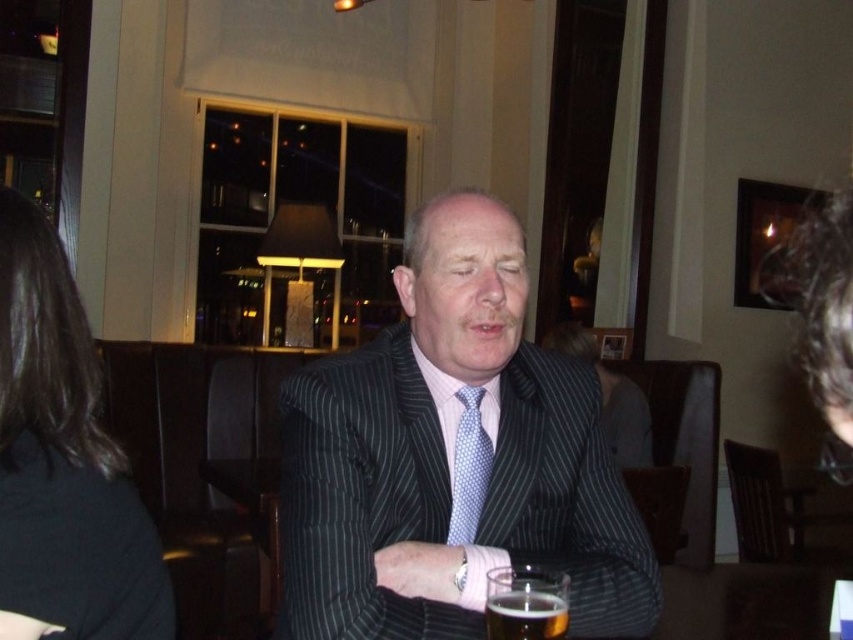
Is pinstriped suit at center below clear glass at lower center?

No.

Is pinstriped suit at center bigger than clear glass at lower center?

Correct, pinstriped suit at center is larger in size than clear glass at lower center.

Which is in front, point (322, 472) or point (514, 611)?

Point (514, 611) is in front.

The width and height of the screenshot is (853, 640). Find the location of `pinstriped suit at center`. pinstriped suit at center is located at coordinates (451, 458).

Describe the element at coordinates (451, 458) in the screenshot. I see `pinstriped suit at center` at that location.

Does pinstriped suit at center appear on the left side of blue dotted tie at center?

Yes, pinstriped suit at center is to the left of blue dotted tie at center.

Between point (502, 333) and point (465, 429), which one is positioned behind?

Point (465, 429)

Where is `pinstriped suit at center`? pinstriped suit at center is located at coordinates (451, 458).

This screenshot has height=640, width=853. What do you see at coordinates (526, 604) in the screenshot?
I see `clear glass at lower center` at bounding box center [526, 604].

Does clear glass at lower center appear over blue dotted tie at center?

Actually, clear glass at lower center is below blue dotted tie at center.

You are a GUI agent. You are given a task and a screenshot of the screen. Output one action in this format:
    pyautogui.click(x=<x>, y=<y>)
    Task: Click on the clear glass at lower center
    This screenshot has width=853, height=640.
    Given the screenshot: What is the action you would take?
    pyautogui.click(x=526, y=604)